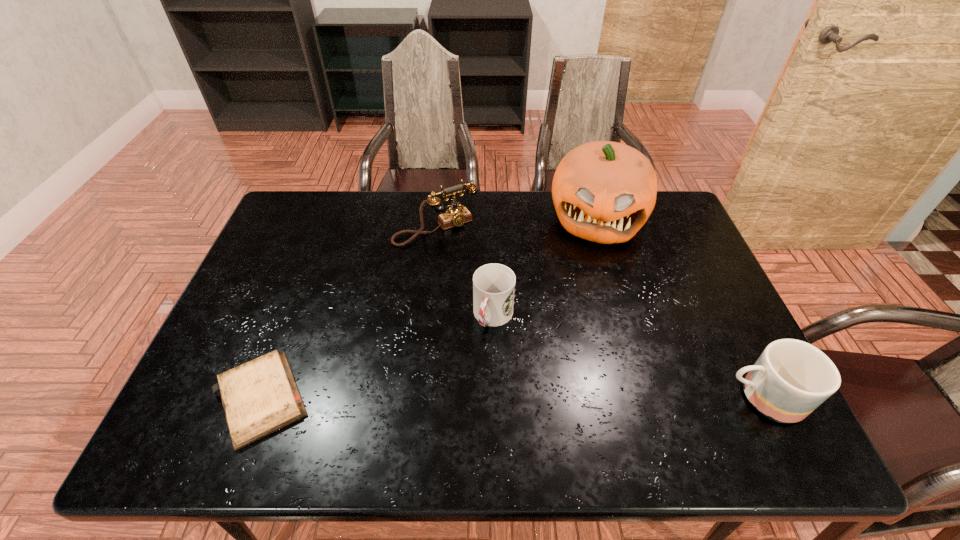
The image size is (960, 540). In the image, there is a desktop. In order to click on vacant space at the far edge in this screenshot , I will do coord(430,194).

In the image, there is a desktop. What are the coordinates of `free space at the near edge` in the screenshot? It's located at (554, 404).

This screenshot has height=540, width=960. What are the coordinates of `free space at the left edge of the desktop` in the screenshot? It's located at (254, 315).

This screenshot has height=540, width=960. I want to click on vacant region at the right edge of the desktop, so (x=691, y=237).

This screenshot has width=960, height=540. In the image, there is a desktop. Identify the location of vacant space at the far left corner. (307, 214).

This screenshot has height=540, width=960. In order to click on free point at the far right corner in this screenshot , I will do `click(654, 231)`.

Find the location of a particular element. The width and height of the screenshot is (960, 540). vacant space at the near right corner of the desktop is located at coordinates (722, 379).

Identify the location of empty space between the fourth object from left to right and the third farthest object. (545, 267).

Find the location of a particular element. This screenshot has height=540, width=960. free space between the cup and the rightmost object is located at coordinates (628, 357).

Where is `empty space that is in between the telephone and the mug`? empty space that is in between the telephone and the mug is located at coordinates (599, 313).